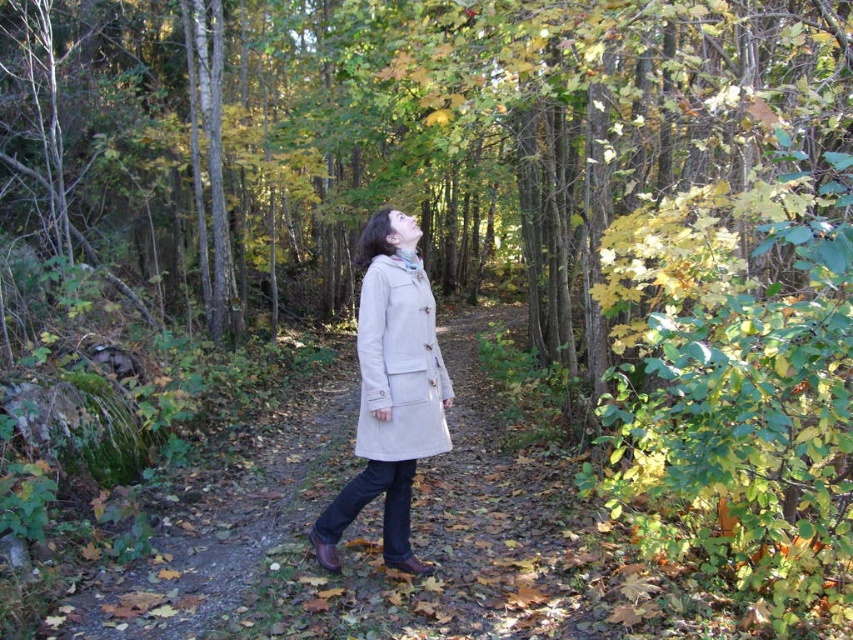
You are a hiker walking along the light beige fabric path at center and wearing the beige cotton trench coat at center. Which object is positioned to the left of the other?

→ The light beige fabric path at center is to the left of the beige cotton trench coat at center.

You are standing on the dirt path in the autumn forest scene. There is a point marked at coordinates (369, 541). What does this point indicate?

The point at coordinates (369, 541) indicates the location of the light beige fabric path at center.

You are standing on the dirt path in the autumn forest scene. There are two points marked in the image. Which point is closer to you, point [485,592] or point [379,339]?

Point [485,592] is further to the viewer than point [379,339], so point [379,339] is closer to you.